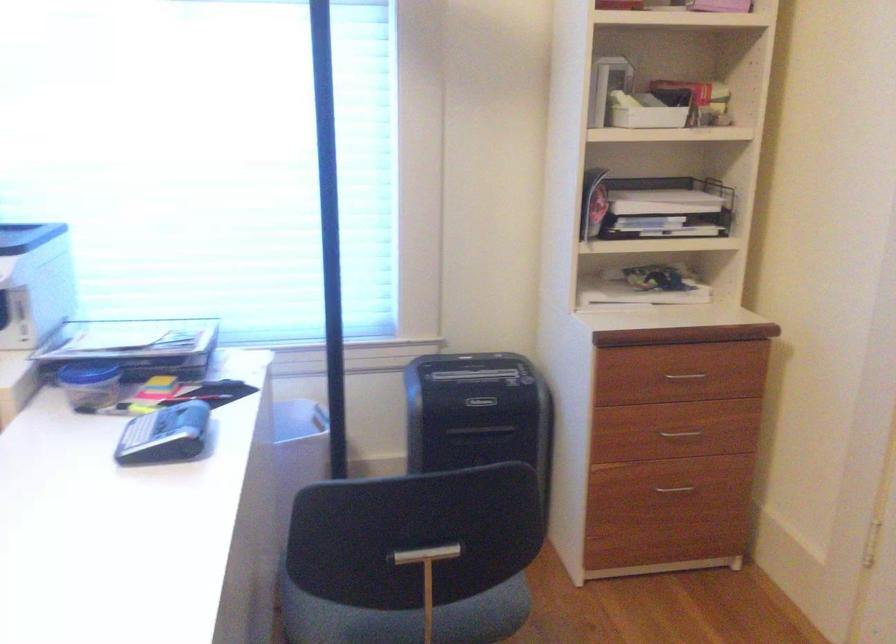
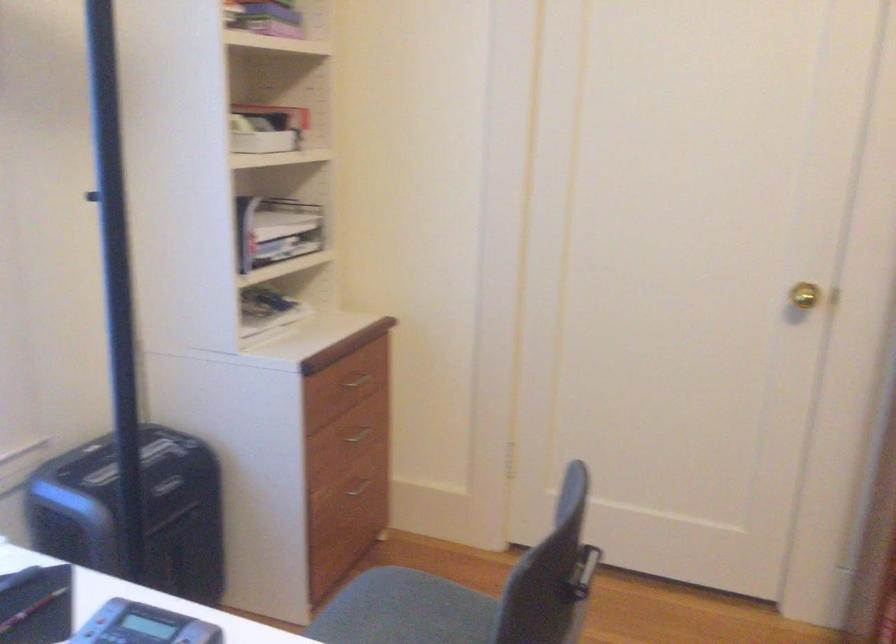
In the second image, find the point that corresponds to point 670,480 in the first image.

(359, 485)